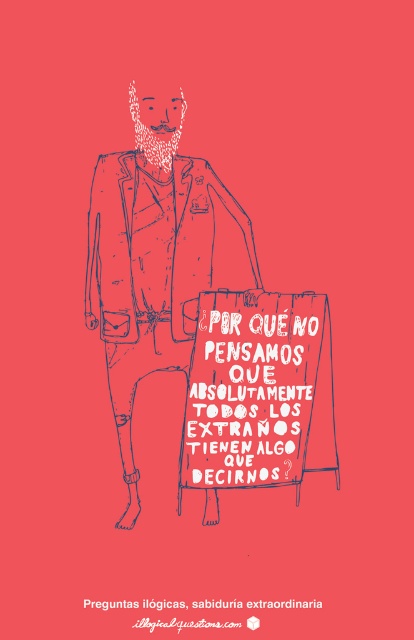
Question: Does blue sketchy jacket at center have a smaller size compared to red cardboard sign at center?

Choices:
 (A) no
 (B) yes

Answer: (A)

Question: Which of the following is the closest to the observer?

Choices:
 (A) (279, 326)
 (B) (168, 193)

Answer: (B)

Question: Does blue sketchy jacket at center have a lesser width compared to red cardboard sign at center?

Choices:
 (A) yes
 (B) no

Answer: (B)

Question: Does blue sketchy jacket at center have a larger size compared to red cardboard sign at center?

Choices:
 (A) no
 (B) yes

Answer: (B)